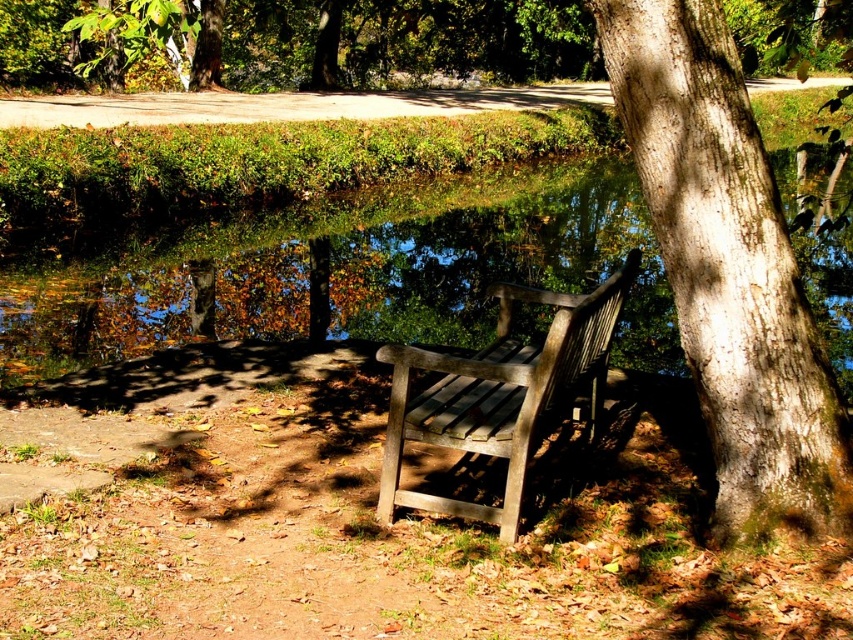
You are planning to set up a picnic blanket in the area between the green reflective water at center and the wooden park bench at center. Which object should you place the blanket closer to if you want it to be in a sunnier spot?

The wooden park bench at center is under the shade of a large tree, so placing the picnic blanket closer to the green reflective water at center would be sunnier since it is not under the tree shade.

You are sitting on the wooden park bench at center and want to look at the green reflective water at center. In which direction should you turn your head?

You should turn your head to the right because the green reflective water at center is to the right of the wooden park bench at center.

You are standing at the point labeled point (x=651, y=42) and want to walk towards the tree trunk. Will you pass by point (x=602, y=378) on your way?

Yes, because point (x=651, y=42) is in front of point (x=602, y=378), so walking towards the tree trunk would require passing through point (x=602, y=378).